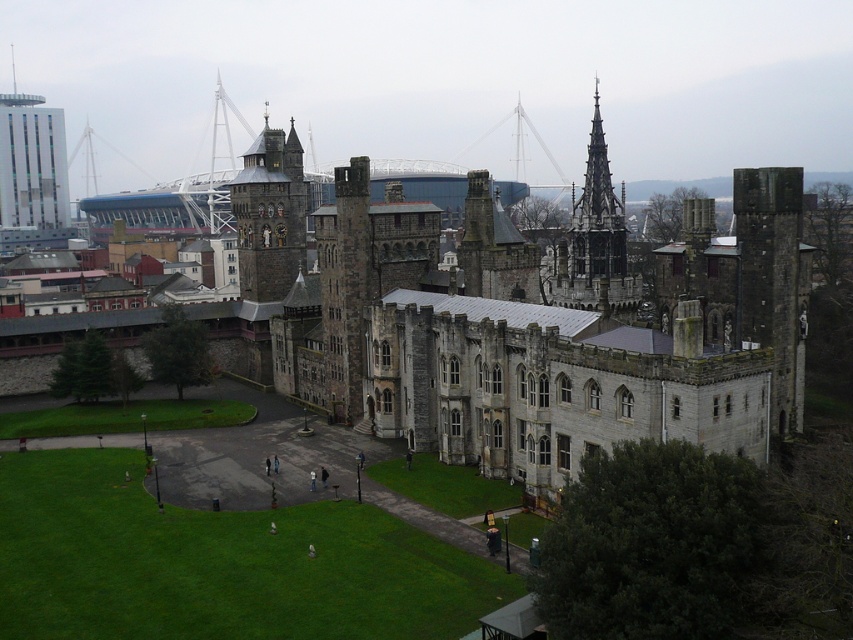
Is dark gray stone tower at center to the right of dark gray stone spire at upper right from the viewer's perspective?

No, dark gray stone tower at center is not to the right of dark gray stone spire at upper right.

Which is in front, point (299, 260) or point (581, 289)?

Point (581, 289)

The image size is (853, 640). In order to click on dark gray stone tower at center in this screenshot , I will do `click(270, 214)`.

Is point (578, 385) closer to viewer compared to point (54, 205)?

Yes, point (578, 385) is closer to viewer.

Who is higher up, gray stone castle at center or matte glass skyscraper at upper left?

matte glass skyscraper at upper left is higher up.

This screenshot has height=640, width=853. Describe the element at coordinates (547, 326) in the screenshot. I see `gray stone castle at center` at that location.

Find the location of `gray stone castle at center`. gray stone castle at center is located at coordinates (547, 326).

Can you confirm if dark gray stone tower at center is bigger than matte glass skyscraper at upper left?

Actually, dark gray stone tower at center might be smaller than matte glass skyscraper at upper left.

In the scene shown: Can you confirm if dark gray stone tower at center is positioned to the left of matte glass skyscraper at upper left?

No, dark gray stone tower at center is not to the left of matte glass skyscraper at upper left.

Between point (296, 216) and point (45, 177), which one is positioned behind?

The point (45, 177) is more distant.

You are a GUI agent. You are given a task and a screenshot of the screen. Output one action in this format:
    pyautogui.click(x=<x>, y=<y>)
    Task: Click on the dark gray stone tower at center
    The width and height of the screenshot is (853, 640).
    Given the screenshot: What is the action you would take?
    pyautogui.click(x=270, y=214)